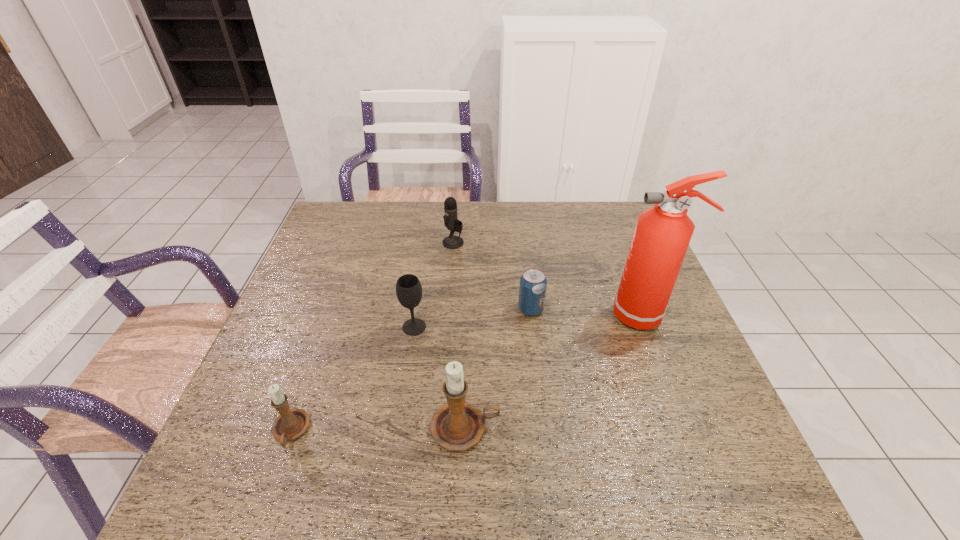
Locate an element on the screen. This screenshot has width=960, height=540. free space between the wineglass and the shorter candle holder is located at coordinates (352, 379).

Locate an element on the screen. This screenshot has width=960, height=540. free space between the rightmost object and the taller candle holder is located at coordinates (556, 372).

Locate an element on the screen. The height and width of the screenshot is (540, 960). vacant area between the rightmost object and the microphone is located at coordinates (550, 279).

The width and height of the screenshot is (960, 540). I want to click on free spot between the fire extinguisher and the wineglass, so click(x=530, y=321).

This screenshot has height=540, width=960. Find the location of `empty location between the second object from right to left and the rightmost object`. empty location between the second object from right to left and the rightmost object is located at coordinates (588, 312).

Image resolution: width=960 pixels, height=540 pixels. What are the coordinates of `vacant area that lies between the microphone and the rightmost object` in the screenshot? It's located at (550, 279).

You are a GUI agent. You are given a task and a screenshot of the screen. Output one action in this format:
    pyautogui.click(x=<x>, y=<y>)
    Task: Click on the second closest object to the leftmost object
    The width and height of the screenshot is (960, 540).
    Given the screenshot: What is the action you would take?
    pyautogui.click(x=408, y=287)

The image size is (960, 540). I want to click on object that can be found as the second closest to the left candle holder, so click(x=408, y=287).

The image size is (960, 540). In order to click on free point that satisfies the following two spatial constraints: 1. at the nozzle of the fire extinguisher; 2. on the side of the leftmost object with the handle in this screenshot , I will do `click(692, 431)`.

The height and width of the screenshot is (540, 960). I want to click on vacant space that satisfies the following two spatial constraints: 1. on the side of the right candle holder with the handle; 2. on the side of the leftmost object with the handle, so click(465, 431).